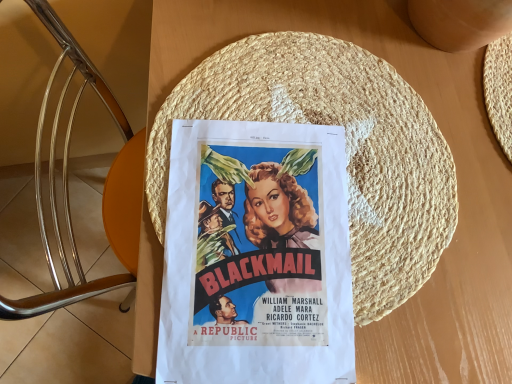
Identify the location of vacant space underneath woven straw hat at center (from a real-world perspective). (341, 183).